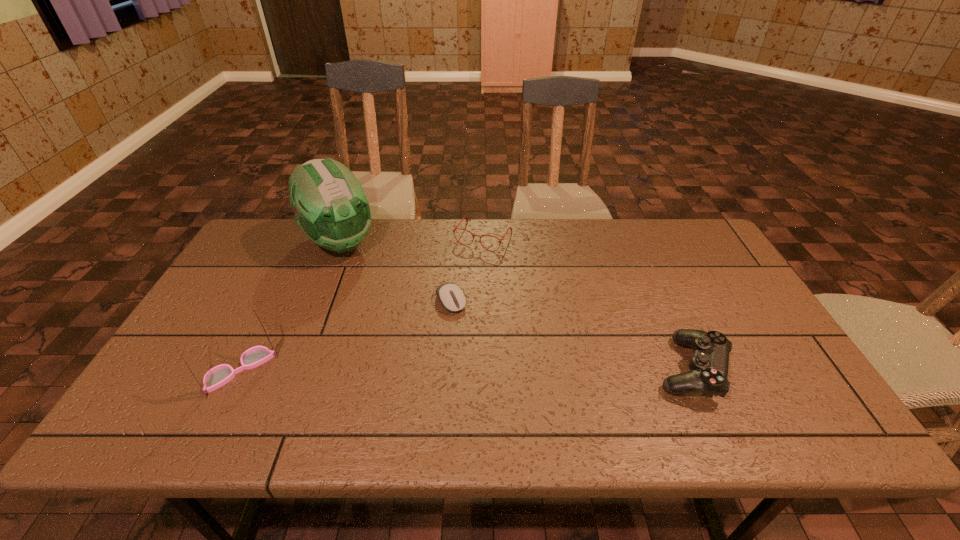
The image size is (960, 540). I want to click on free point between the taller spectacles and the shorter spectacles, so click(x=362, y=303).

Locate an element on the screen. This screenshot has width=960, height=540. free spot between the third nearest object and the football helmet is located at coordinates (396, 272).

Find the location of a particular element. The height and width of the screenshot is (540, 960). free space between the football helmet and the third farthest object is located at coordinates (396, 272).

This screenshot has width=960, height=540. What are the coordinates of `object that can be found as the closest to the shorter spectacles` in the screenshot? It's located at (451, 296).

Locate which object is the fourth closest to the rightmost object. Please provide its 2D coordinates. Your answer should be formatted as a tuple, i.e. [(x, y)], where the tuple contains the x and y coordinates of a point satisfying the conditions above.

[(218, 376)]

Where is `free space in the image that satisfies the following two spatial constraints: 1. on the back side of the football helmet; 2. on the right side of the farther spectacles`? free space in the image that satisfies the following two spatial constraints: 1. on the back side of the football helmet; 2. on the right side of the farther spectacles is located at coordinates (342, 237).

Where is `free space that satisfies the following two spatial constraints: 1. on the front side of the farther spectacles; 2. on the right side of the rightmost object`? This screenshot has height=540, width=960. free space that satisfies the following two spatial constraints: 1. on the front side of the farther spectacles; 2. on the right side of the rightmost object is located at coordinates (485, 369).